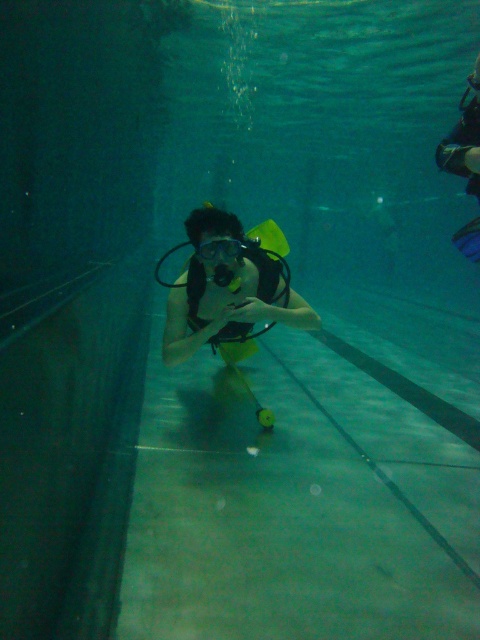
Question: Which of the following is the farthest from the observer?

Choices:
 (A) (230, 257)
 (B) (202, 339)

Answer: (B)

Question: Can you confirm if yellow matte scuba gear at center is smaller than transparent plastic goggles at center?

Choices:
 (A) no
 (B) yes

Answer: (A)

Question: Which point appears farthest from the camera in this image?

Choices:
 (A) tap(263, 280)
 (B) tap(231, 250)

Answer: (A)

Question: Does yellow matte scuba gear at center come behind transparent plastic goggles at center?

Choices:
 (A) no
 (B) yes

Answer: (A)

Question: Does yellow matte scuba gear at center have a lesser width compared to transparent plastic goggles at center?

Choices:
 (A) no
 (B) yes

Answer: (A)